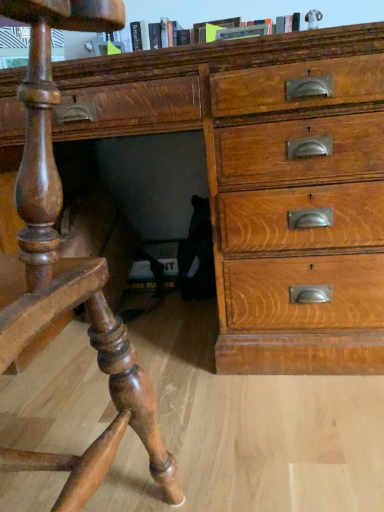
Question: Can you see shiny polished wood desk at lower left touching wooden chest of drawers at center?

Choices:
 (A) no
 (B) yes

Answer: (A)

Question: Is shiny polished wood desk at lower left wider than wooden chest of drawers at center?

Choices:
 (A) no
 (B) yes

Answer: (A)

Question: Does shiny polished wood desk at lower left appear on the left side of wooden chest of drawers at center?

Choices:
 (A) yes
 (B) no

Answer: (A)

Question: Considering the relative sizes of shiny polished wood desk at lower left and wooden chest of drawers at center in the image provided, is shiny polished wood desk at lower left thinner than wooden chest of drawers at center?

Choices:
 (A) no
 (B) yes

Answer: (B)

Question: From the image's perspective, is shiny polished wood desk at lower left under wooden chest of drawers at center?

Choices:
 (A) no
 (B) yes

Answer: (B)

Question: Which is correct: shiny polished wood desk at lower left is inside wooden chest of drawers at center, or outside of it?

Choices:
 (A) inside
 (B) outside

Answer: (B)

Question: From the image's perspective, is shiny polished wood desk at lower left positioned above or below wooden chest of drawers at center?

Choices:
 (A) below
 (B) above

Answer: (A)

Question: In the image, is shiny polished wood desk at lower left positioned in front of or behind wooden chest of drawers at center?

Choices:
 (A) behind
 (B) front

Answer: (B)

Question: Looking at their shapes, would you say shiny polished wood desk at lower left is wider or thinner than wooden chest of drawers at center?

Choices:
 (A) wide
 (B) thin

Answer: (B)

Question: Is wooden chest of drawers at center to the left or to the right of shiny polished wood desk at lower left in the image?

Choices:
 (A) left
 (B) right

Answer: (B)

Question: Do you think wooden chest of drawers at center is within shiny polished wood desk at lower left, or outside of it?

Choices:
 (A) inside
 (B) outside

Answer: (B)

Question: Considering the positions of point (120, 117) and point (16, 343), is point (120, 117) closer or farther from the camera than point (16, 343)?

Choices:
 (A) closer
 (B) farther

Answer: (B)

Question: Is wooden chest of drawers at center in front of or behind shiny polished wood desk at lower left in the image?

Choices:
 (A) front
 (B) behind

Answer: (B)

Question: Is point (91, 318) closer or farther from the camera than point (203, 24)?

Choices:
 (A) closer
 (B) farther

Answer: (A)

Question: From a real-world perspective, is shiny polished wood desk at lower left positioned above or below hardcover book at upper center?

Choices:
 (A) above
 (B) below

Answer: (B)